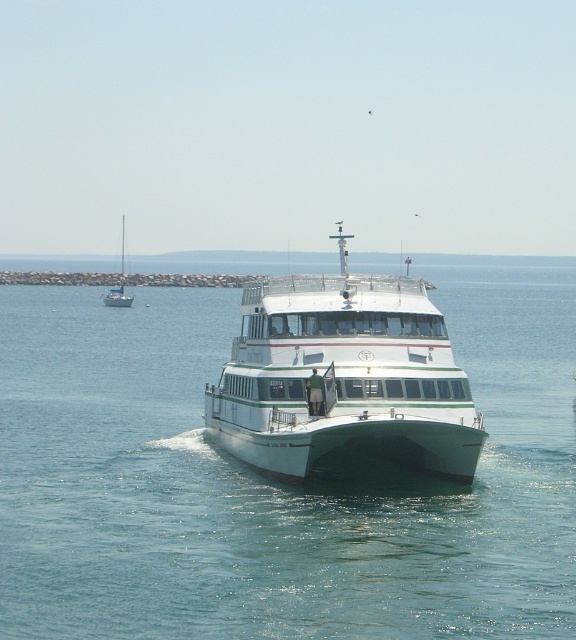
Question: Where is green water at center located in relation to white glossy sailboat at left in the image?

Choices:
 (A) below
 (B) above

Answer: (A)

Question: Which object appears closest to the camera in this image?

Choices:
 (A) white glossy cruise ship at center
 (B) white glossy sailboat at left
 (C) green water at center

Answer: (C)

Question: Is green water at center bigger than white glossy sailboat at left?

Choices:
 (A) yes
 (B) no

Answer: (A)

Question: Does green water at center have a greater width compared to white glossy sailboat at left?

Choices:
 (A) no
 (B) yes

Answer: (B)

Question: Which of the following is the closest to the observer?

Choices:
 (A) white glossy cruise ship at center
 (B) white glossy sailboat at left

Answer: (A)

Question: Which point appears farthest from the camera in this image?

Choices:
 (A) (468, 580)
 (B) (113, 300)

Answer: (B)